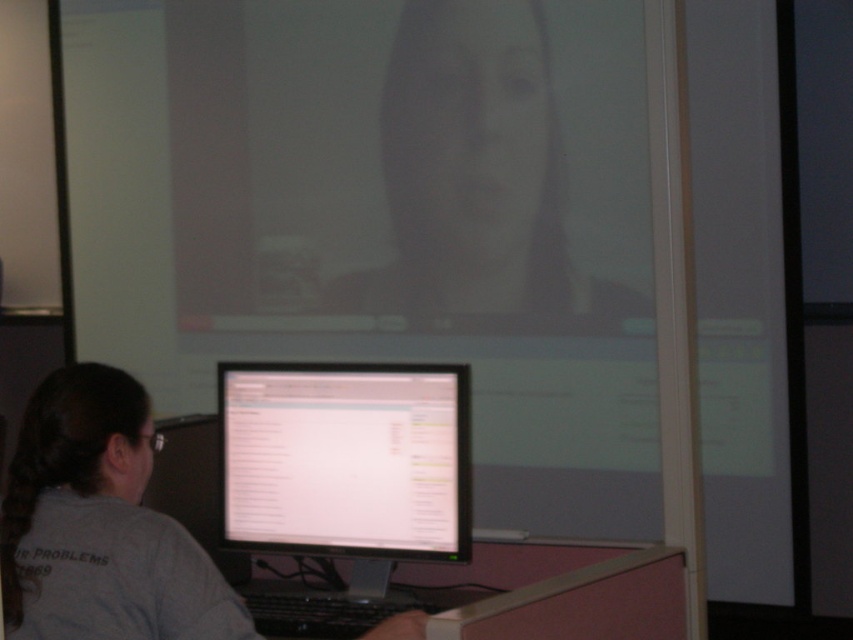
Is point (490, 291) more distant than point (323, 532)?

That is True.

Who is taller, smooth skin face at upper center or white glossy monitor at center?

smooth skin face at upper center

Image resolution: width=853 pixels, height=640 pixels. Find the location of `smooth skin face at upper center`. smooth skin face at upper center is located at coordinates (479, 180).

Find the location of a particular element. The image size is (853, 640). smooth skin face at upper center is located at coordinates (479, 180).

Does matte white screen at upper center have a smaller size compared to white glossy monitor at center?

Incorrect, matte white screen at upper center is not smaller in size than white glossy monitor at center.

Image resolution: width=853 pixels, height=640 pixels. Find the location of `matte white screen at upper center`. matte white screen at upper center is located at coordinates (383, 216).

The width and height of the screenshot is (853, 640). Identify the location of matte white screen at upper center. (383, 216).

From the picture: Is matte white screen at upper center thinner than smooth skin face at upper center?

No, matte white screen at upper center is not thinner than smooth skin face at upper center.

Is the position of matte white screen at upper center more distant than that of smooth skin face at upper center?

No, it is not.

The height and width of the screenshot is (640, 853). Describe the element at coordinates (383, 216) in the screenshot. I see `matte white screen at upper center` at that location.

This screenshot has height=640, width=853. What are the coordinates of `matte white screen at upper center` in the screenshot? It's located at [x=383, y=216].